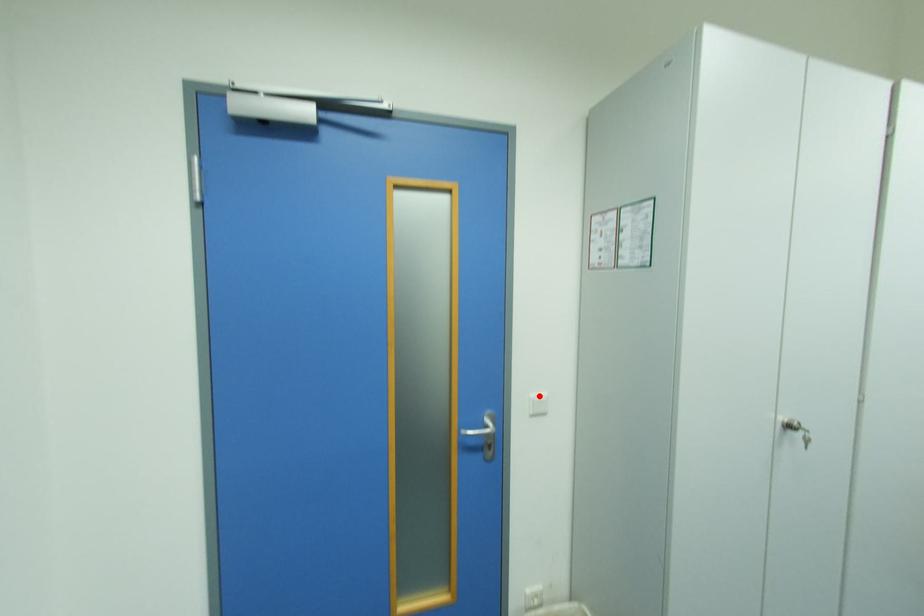
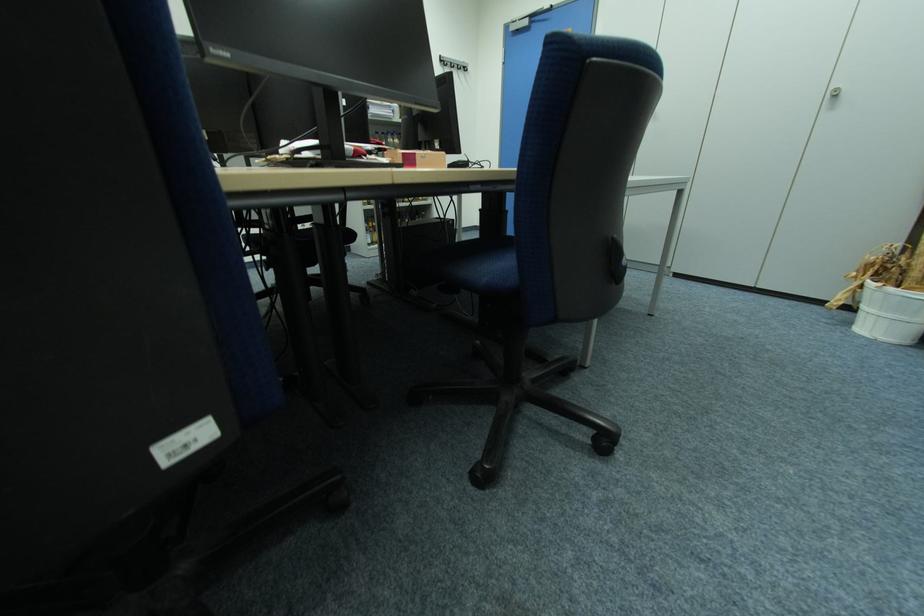
Question: I am providing you with two images of the same scene from different viewpoints. A red point is marked on the first image. Can you still see the location of the red point in image 2?

Choices:
 (A) Yes
 (B) No

Answer: (B)